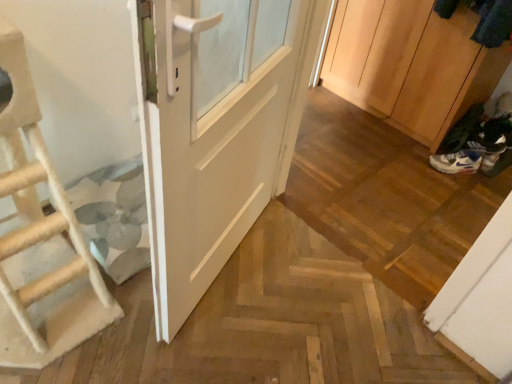
Question: Can you confirm if wooden cabinet at right is smaller than beige rope ladder at left?

Choices:
 (A) no
 (B) yes

Answer: (A)

Question: Is wooden cabinet at right beside beige rope ladder at left?

Choices:
 (A) yes
 (B) no

Answer: (B)

Question: Is wooden cabinet at right far away from beige rope ladder at left?

Choices:
 (A) yes
 (B) no

Answer: (A)

Question: Is wooden cabinet at right positioned with its back to beige rope ladder at left?

Choices:
 (A) no
 (B) yes

Answer: (A)

Question: Is wooden cabinet at right positioned before beige rope ladder at left?

Choices:
 (A) yes
 (B) no

Answer: (B)

Question: From the image's perspective, is white matte door at center located above or below beige rope ladder at left?

Choices:
 (A) above
 (B) below

Answer: (A)

Question: From a real-world perspective, relative to beige rope ladder at left, is white matte door at center vertically above or below?

Choices:
 (A) below
 (B) above

Answer: (B)

Question: From their relative heights in the image, would you say white matte door at center is taller or shorter than beige rope ladder at left?

Choices:
 (A) tall
 (B) short

Answer: (A)

Question: Would you say white matte door at center is inside or outside beige rope ladder at left?

Choices:
 (A) outside
 (B) inside

Answer: (A)

Question: Is white mesh shoe at lower right spatially inside beige rope ladder at left, or outside of it?

Choices:
 (A) outside
 (B) inside

Answer: (A)

Question: In the image, is white mesh shoe at lower right positioned in front of or behind beige rope ladder at left?

Choices:
 (A) behind
 (B) front

Answer: (A)

Question: From the image's perspective, relative to beige rope ladder at left, is white mesh shoe at lower right above or below?

Choices:
 (A) above
 (B) below

Answer: (A)

Question: Considering the positions of white mesh shoe at lower right and beige rope ladder at left in the image, is white mesh shoe at lower right bigger or smaller than beige rope ladder at left?

Choices:
 (A) big
 (B) small

Answer: (B)

Question: Does point (206, 34) appear closer or farther from the camera than point (428, 3)?

Choices:
 (A) closer
 (B) farther

Answer: (A)

Question: From a real-world perspective, is white matte door at center positioned above or below wooden cabinet at right?

Choices:
 (A) below
 (B) above

Answer: (B)